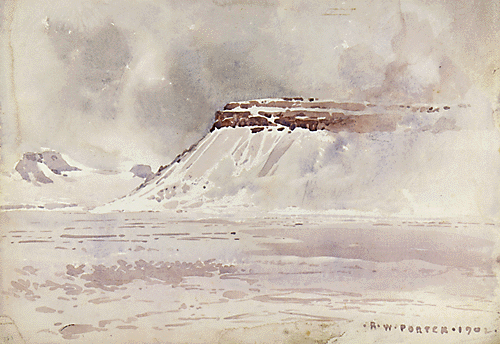
Find the location of a particular element. The image size is (500, 344). oil painting is located at coordinates (396, 226).